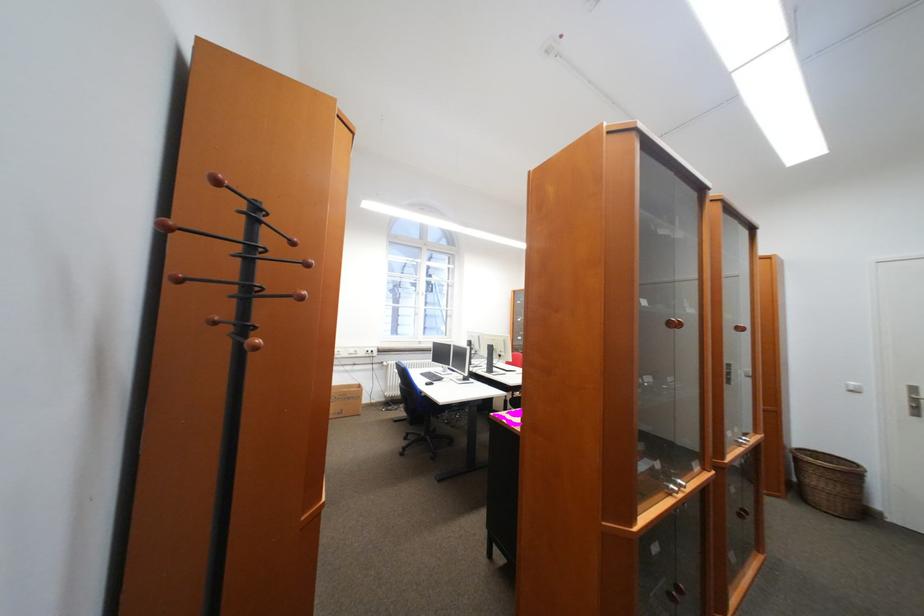
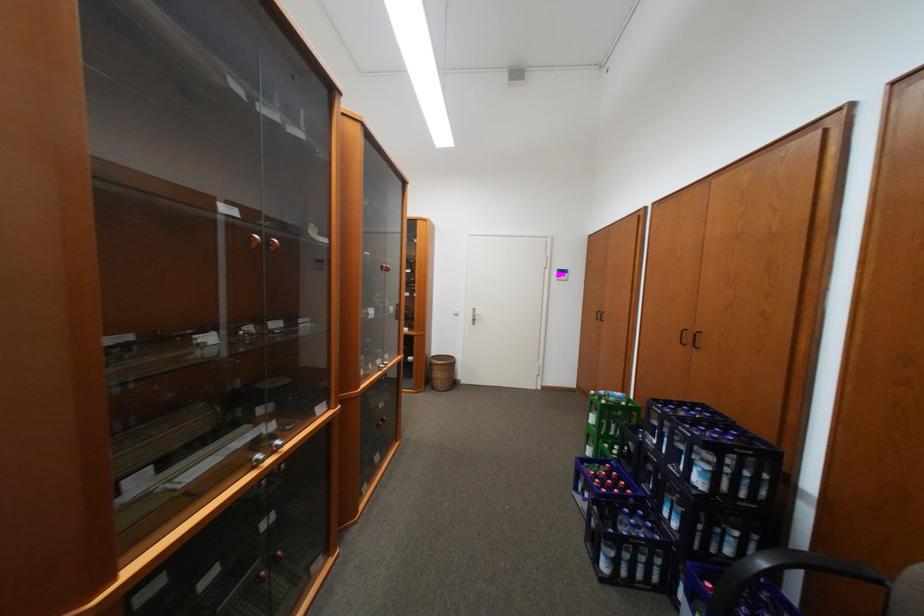
Question: Based on the continuous images, in which direction is the camera rotating? Reply with the corresponding letter.

Choices:
 (A) Left
 (B) Right
 (C) Up
 (D) Down

Answer: (B)